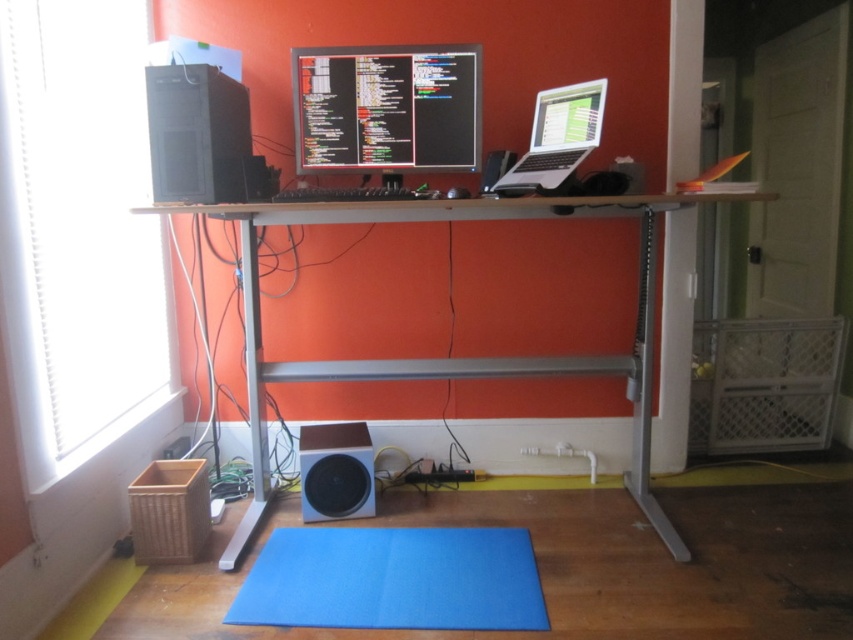
Is black glossy monitor at center shorter than silver metallic laptop at upper right?

No, black glossy monitor at center is not shorter than silver metallic laptop at upper right.

Based on the photo, can you confirm if black glossy monitor at center is positioned above silver metallic laptop at upper right?

Indeed, black glossy monitor at center is positioned over silver metallic laptop at upper right.

Find the location of a particular element. Image resolution: width=853 pixels, height=640 pixels. black glossy monitor at center is located at coordinates (386, 108).

Does blue felt mat at lower center come in front of black glossy monitor at center?

Yes.

What are the coordinates of `blue felt mat at lower center` in the screenshot? It's located at (393, 579).

Does blue felt mat at lower center have a greater height compared to white matte speaker at lower center?

No.

Is blue felt mat at lower center positioned at the back of white matte speaker at lower center?

No, it is not.

Is point (540, 620) less distant than point (334, 460)?

Yes, point (540, 620) is in front of point (334, 460).

Identify the location of blue felt mat at lower center. (393, 579).